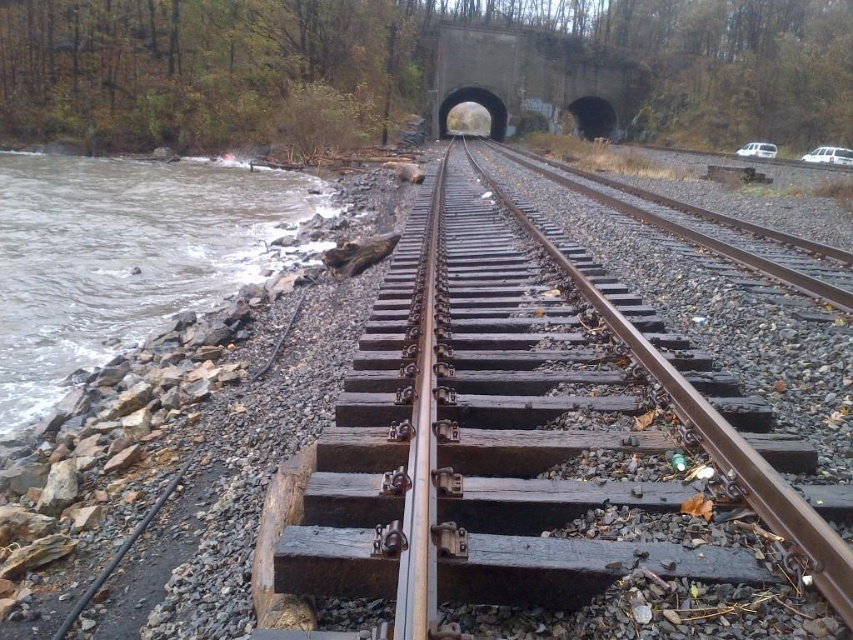
You are standing at the point marked by coordinates point (x=531, y=442) in the image. What object are you standing on?

You are standing on the rusty metal track at center marked by point (x=531, y=442).